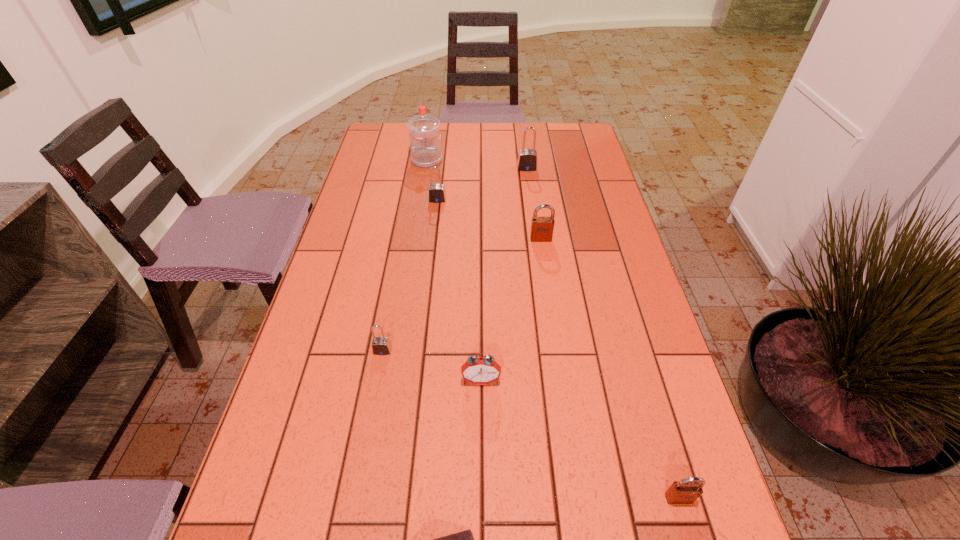
Locate an element on the screen. This screenshot has width=960, height=540. free space between the second padlock from left to right and the alarm clock is located at coordinates (459, 291).

Find the location of `free space between the rightmost gray padlock and the third nearest object`. free space between the rightmost gray padlock and the third nearest object is located at coordinates (504, 274).

At what (x,y) coordinates should I click in order to perform the action: click on free point between the farthest gray padlock and the right brown padlock. Please return your answer as a coordinate pair (x, y). The width and height of the screenshot is (960, 540). Looking at the image, I should click on (603, 333).

Locate an element on the screen. The height and width of the screenshot is (540, 960). empty location between the second gray padlock from right to left and the alarm clock is located at coordinates (459, 291).

In order to click on free point between the alarm clock and the tallest object in this screenshot , I will do `click(454, 271)`.

This screenshot has height=540, width=960. What are the coordinates of `free point between the nearer brown padlock and the second farthest gray padlock` in the screenshot? It's located at (558, 349).

Point out which object is positioned as the second nearest to the third nearest object. Please provide its 2D coordinates. Your answer should be formatted as a tuple, i.e. [(x, y)], where the tuple contains the x and y coordinates of a point satisfying the conditions above.

[(464, 539)]

Identify which object is the third nearest to the second gray padlock from left to right. Please provide its 2D coordinates. Your answer should be formatted as a tuple, i.e. [(x, y)], where the tuple contains the x and y coordinates of a point satisfying the conditions above.

[(542, 228)]

Identify which padlock is located as the second nearest to the sixth farthest object. Please provide its 2D coordinates. Your answer should be formatted as a tuple, i.e. [(x, y)], where the tuple contains the x and y coordinates of a point satisfying the conditions above.

[(686, 491)]

At what (x,y) coordinates should I click in order to perform the action: click on padlock that stands as the third closest to the second gray padlock from right to left. Please return your answer as a coordinate pair (x, y). Looking at the image, I should click on (380, 345).